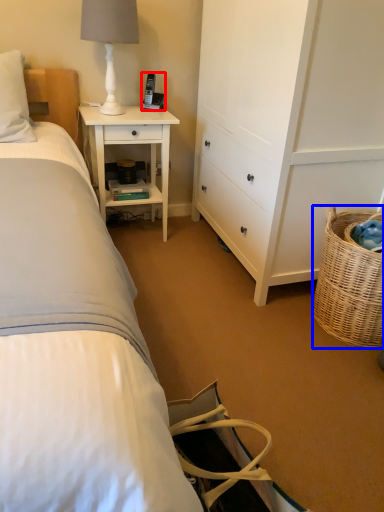
Question: Among these objects, which one is nearest to the camera, corded phone (highlighted by a red box) or picnic basket (highlighted by a blue box)?

Choices:
 (A) corded phone
 (B) picnic basket

Answer: (B)